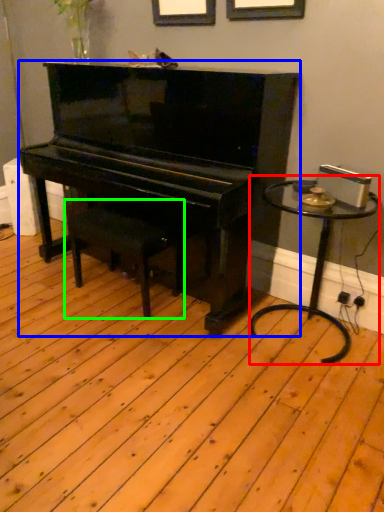
Question: Considering the real-world distances, which object is closest to table (highlighted by a red box)? piano (highlighted by a blue box) or music stool (highlighted by a green box).

Choices:
 (A) piano
 (B) music stool

Answer: (A)